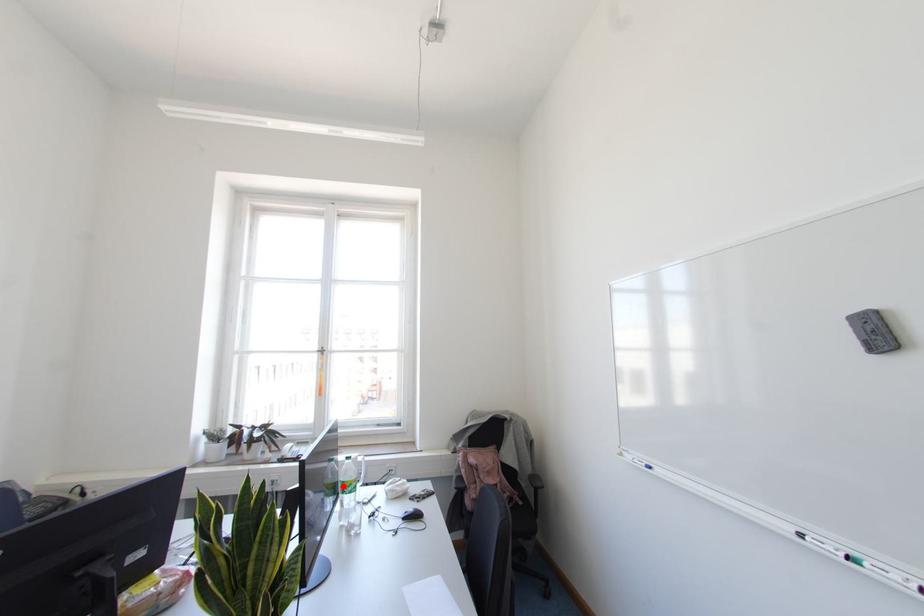
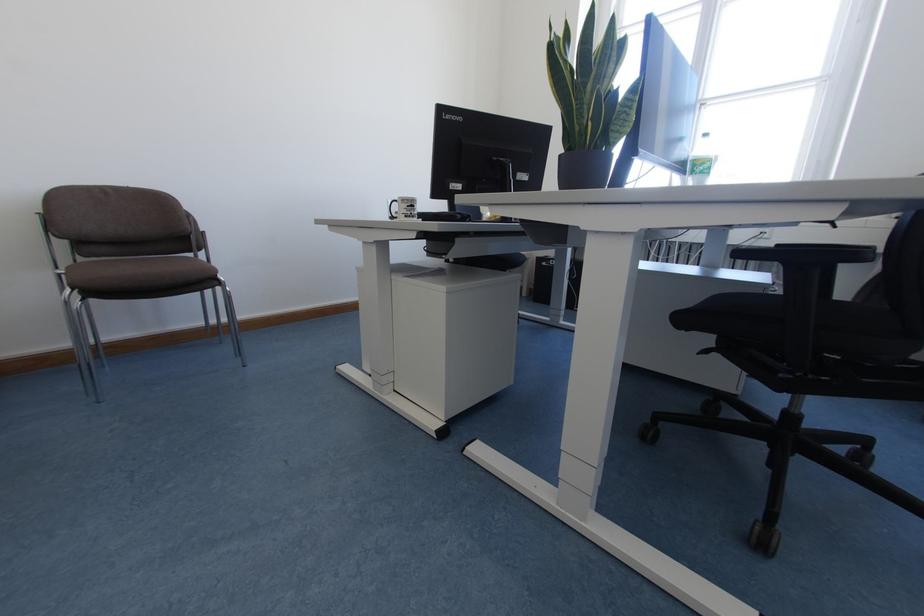
The point at the highlighted location is marked in the first image. Where is the corresponding point in the second image?

(694, 164)